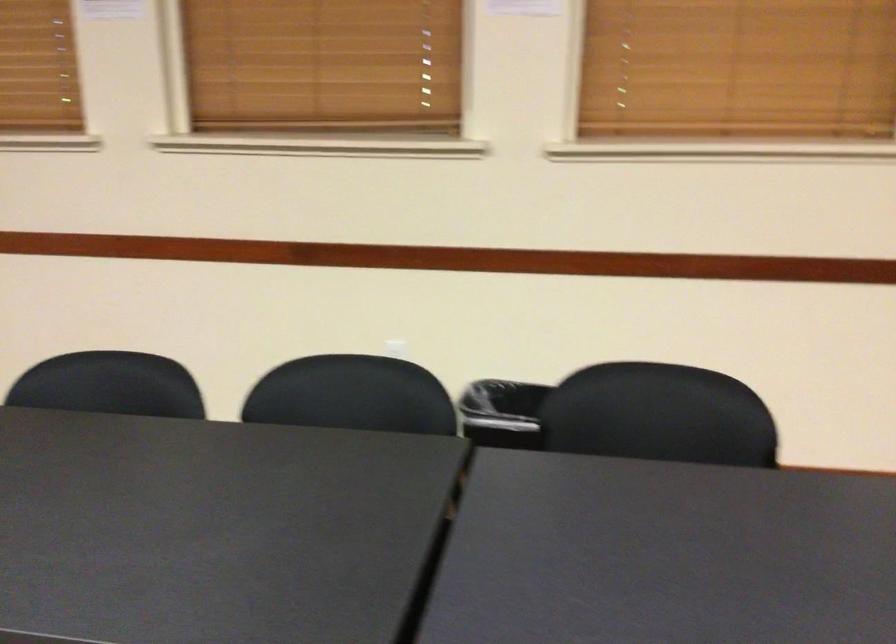
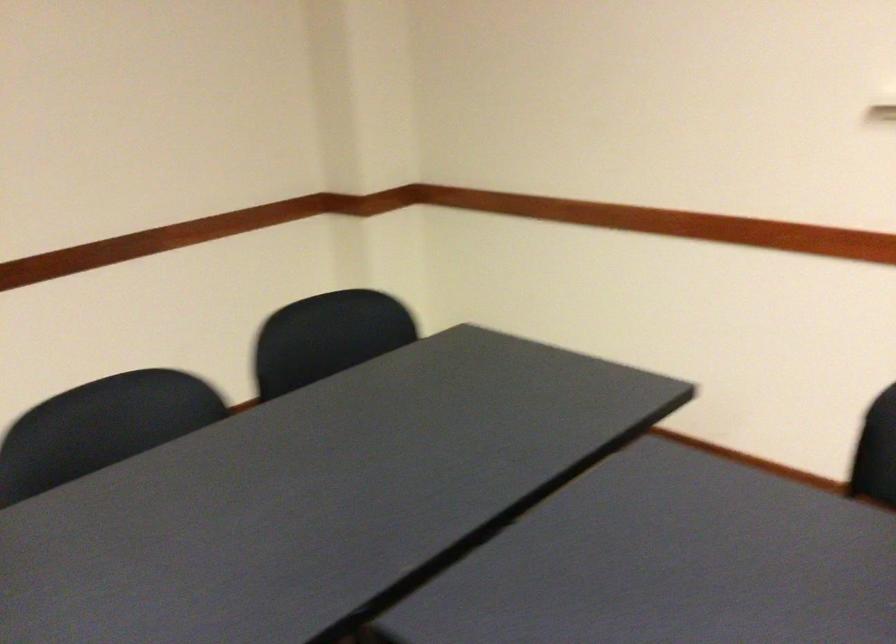
Question: The camera is either moving clockwise (left) or counter-clockwise (right) around the object. The first image is from the beginning of the video and the second image is from the end. Is the camera moving left or right when shooting the video?

Choices:
 (A) Left
 (B) Right

Answer: (A)